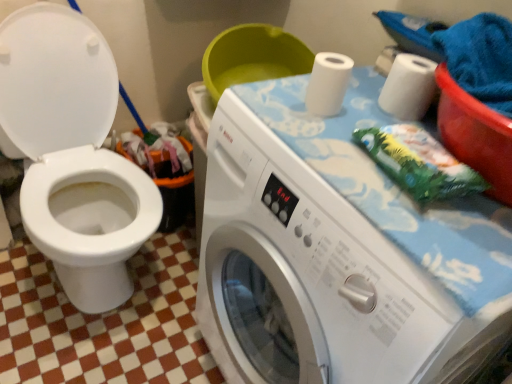
Locate an element on the screen. The width and height of the screenshot is (512, 384). empty space that is ontop of white plastic washing machine at center (from a real-world perspective) is located at coordinates (370, 164).